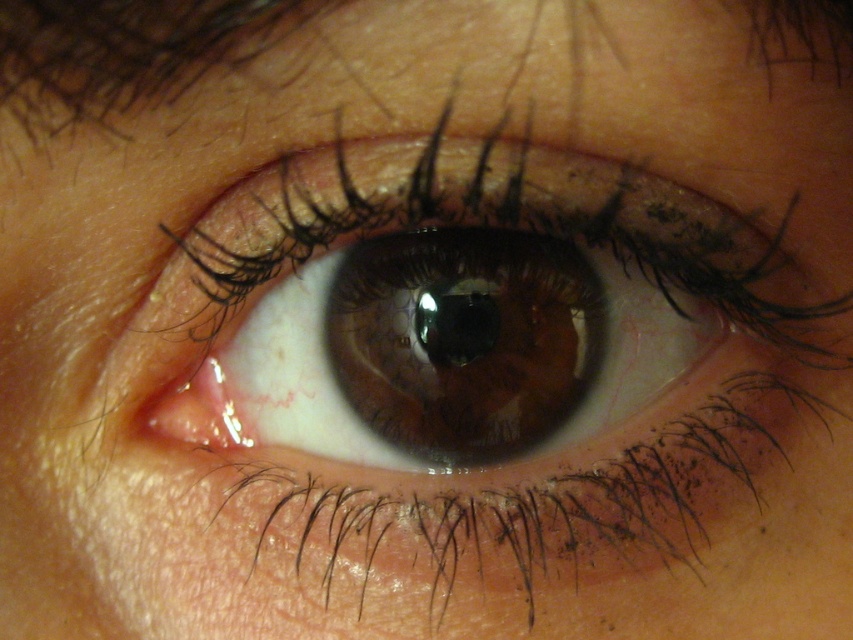
You are a photographer adjusting your camera to focus on the brown glossy eye at center and the brown hair at upper left. Which object should you focus on first if you want to capture both clearly in the same shot?

The brown glossy eye at center should be focused on first because it is closer to the viewer than the brown hair at upper left, ensuring both are in focus when using depth of field techniques.

You are a photographer checking the composition of a portrait. You notice the brown glossy eye at center and the brown hair at upper left in the frame. Which object occupies more vertical space in the image?

The brown glossy eye at center is taller than brown hair at upper left, so it occupies more vertical space in the image.